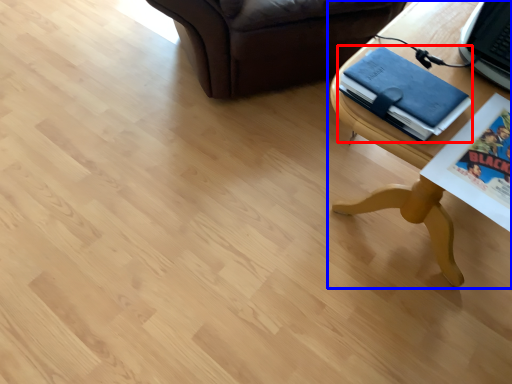
Question: Among these objects, which one is farthest to the camera, binder (highlighted by a red box) or table (highlighted by a blue box)?

Choices:
 (A) binder
 (B) table

Answer: (A)